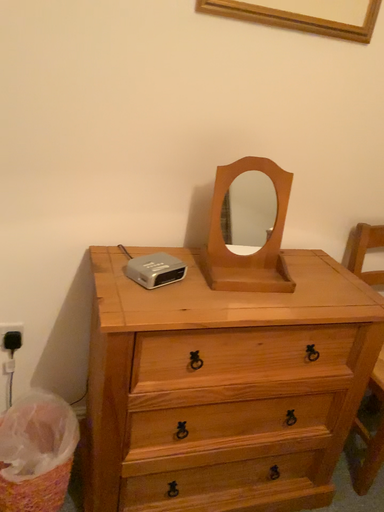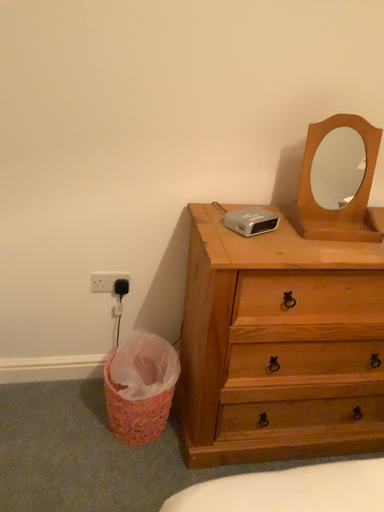
Question: Which way did the camera rotate in the video?

Choices:
 (A) rotated left
 (B) rotated right

Answer: (A)